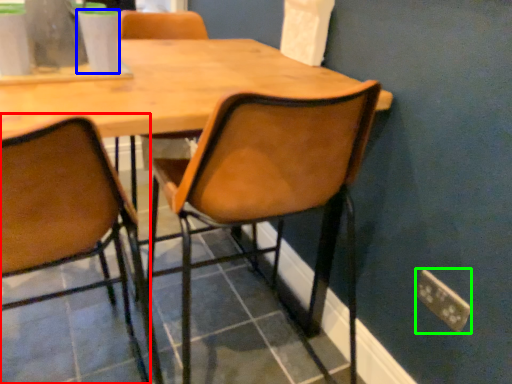
Question: Which is farther away from chair (highlighted by a red box)? coffee cup (highlighted by a blue box) or power plugs and sockets (highlighted by a green box)?

Choices:
 (A) coffee cup
 (B) power plugs and sockets

Answer: (B)